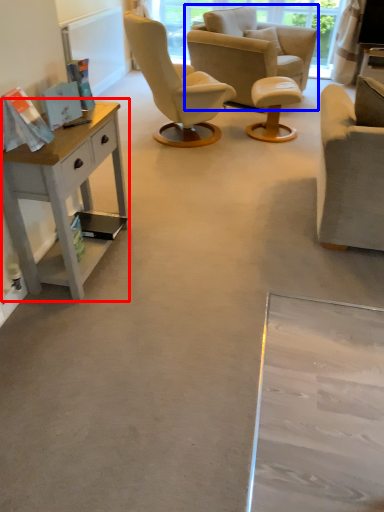
Question: Among these objects, which one is farthest to the camera, desk (highlighted by a red box) or chair (highlighted by a blue box)?

Choices:
 (A) desk
 (B) chair

Answer: (B)